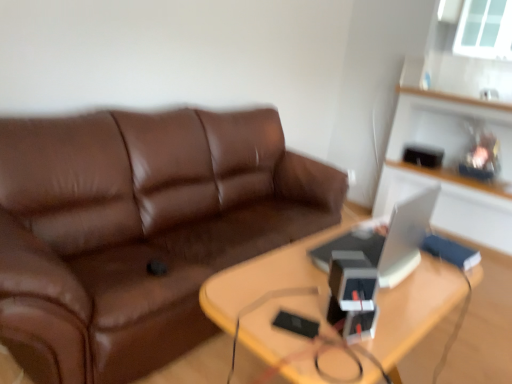
Question: Considering the relative sizes of brown leather couch at center and wooden table at center in the image provided, is brown leather couch at center bigger than wooden table at center?

Choices:
 (A) no
 (B) yes

Answer: (B)

Question: Does brown leather couch at center contain wooden table at center?

Choices:
 (A) yes
 (B) no

Answer: (B)

Question: Is brown leather couch at center wider than wooden table at center?

Choices:
 (A) no
 (B) yes

Answer: (B)

Question: Is brown leather couch at center to the left of wooden table at center from the viewer's perspective?

Choices:
 (A) yes
 (B) no

Answer: (A)

Question: From the image's perspective, is brown leather couch at center beneath wooden table at center?

Choices:
 (A) yes
 (B) no

Answer: (B)

Question: Considering the relative positions of brown leather couch at center and wooden table at center in the image provided, is brown leather couch at center to the right of wooden table at center from the viewer's perspective?

Choices:
 (A) yes
 (B) no

Answer: (B)

Question: Can you confirm if brown leather couch at center is smaller than white glossy computer at right?

Choices:
 (A) no
 (B) yes

Answer: (A)

Question: Is brown leather couch at center behind white glossy computer at right?

Choices:
 (A) yes
 (B) no

Answer: (B)

Question: Is brown leather couch at center oriented away from white glossy computer at right?

Choices:
 (A) no
 (B) yes

Answer: (A)

Question: Considering the relative positions of brown leather couch at center and white glossy computer at right in the image provided, is brown leather couch at center to the left of white glossy computer at right from the viewer's perspective?

Choices:
 (A) yes
 (B) no

Answer: (A)

Question: Can you confirm if brown leather couch at center is thinner than white glossy computer at right?

Choices:
 (A) yes
 (B) no

Answer: (B)

Question: Is brown leather couch at center touching white glossy computer at right?

Choices:
 (A) no
 (B) yes

Answer: (A)

Question: Is transparent glass window at upper right with white glossy computer at right?

Choices:
 (A) no
 (B) yes

Answer: (A)